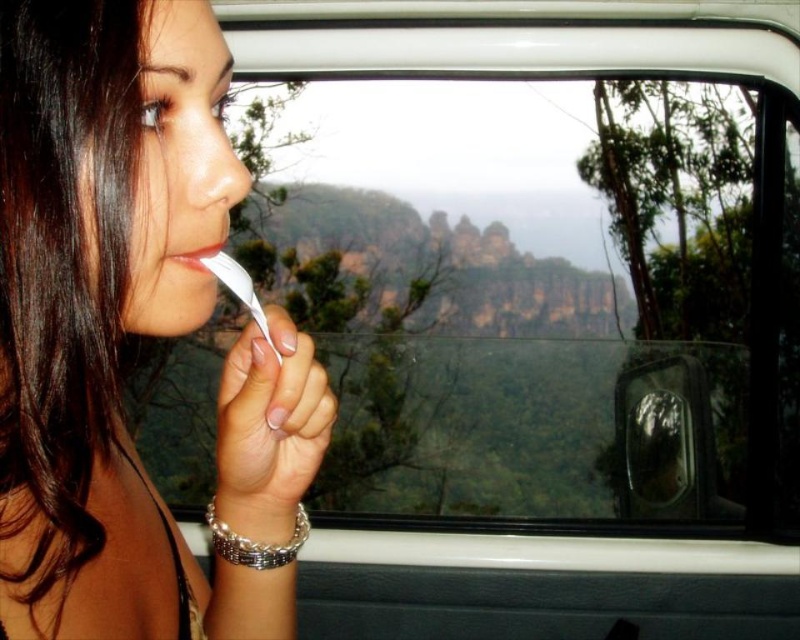
Question: Which of the following is the farthest from the observer?

Choices:
 (A) matte white toothbrush at lower left
 (B) transparent glass car window at center

Answer: (B)

Question: Which point is closer to the camera?

Choices:
 (A) (204, 266)
 (B) (80, 262)
 (C) (402, 371)

Answer: (B)

Question: In this image, where is transparent glass car window at center located relative to matte white feather at center?

Choices:
 (A) right
 (B) left

Answer: (A)

Question: From the image, what is the correct spatial relationship of transparent glass car window at center in relation to matte white toothbrush at lower left?

Choices:
 (A) left
 (B) right

Answer: (B)

Question: Based on their relative distances, which object is farther from the transparent glass car window at center?

Choices:
 (A) matte white toothbrush at lower left
 (B) matte white feather at center

Answer: (A)

Question: Does transparent glass car window at center appear on the right side of matte white toothbrush at lower left?

Choices:
 (A) yes
 (B) no

Answer: (A)